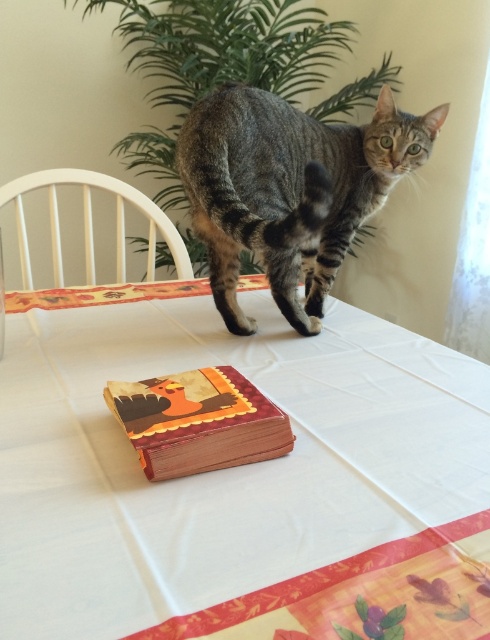
You are a photographer setting up a shot of the tabby fur cat at center and the wooden book at center on a table. You need to ensure that the cat is framed so that its height is emphasized compared to the book. Based on the scene description, can you confirm if the cat is taller than the book?

Yes, the tabby fur cat at center is taller than the wooden book at center according to the description.

You are holding a camera and want to take a closeup photo of the point at coordinate point [483,516]. The camera has a focal length of 50mm and a sensor size of 24mm x 16mm. What is the minimum distance in inches you need to move the camera forward to ensure the point fills the frame vertically?

The point at coordinate point [483,516] is 17.06 inches from the viewer. To calculate the minimum distance needed, first determine the sensor height. The sensor size is 24mm x 16mm, so the vertical dimension is 16mm. The formula for the required distance is focal length multiplied by subject distance divided by sensor height. Plugging in the values, it would be 50mm x 17.06 inches divided by 16mm. This results in approximately 53.3 inches. Subtracting the current distance of 17.06 inches gives a required

What is located at the point with coordinates [239,477] in the image?

The point at coordinates [239,477] indicates white cloth at center.